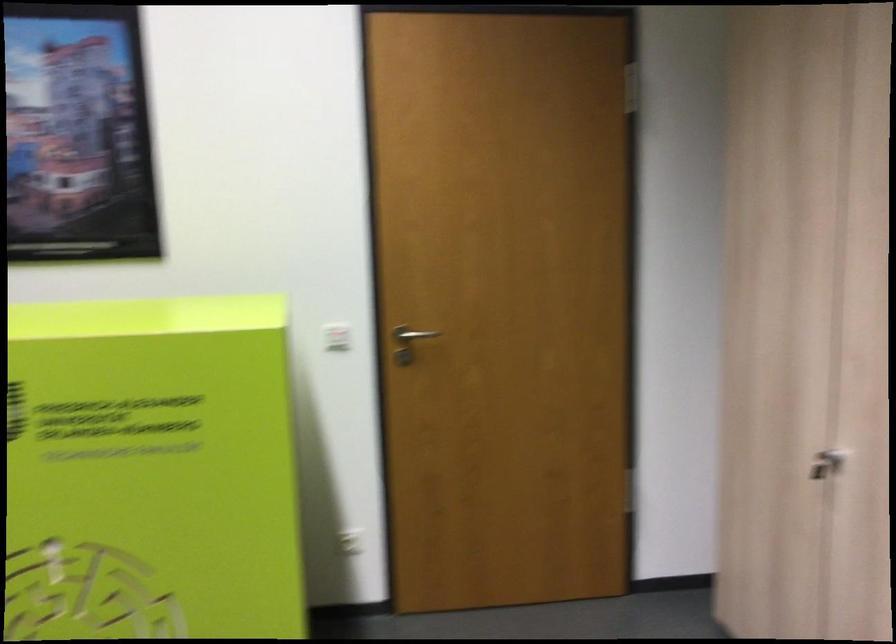
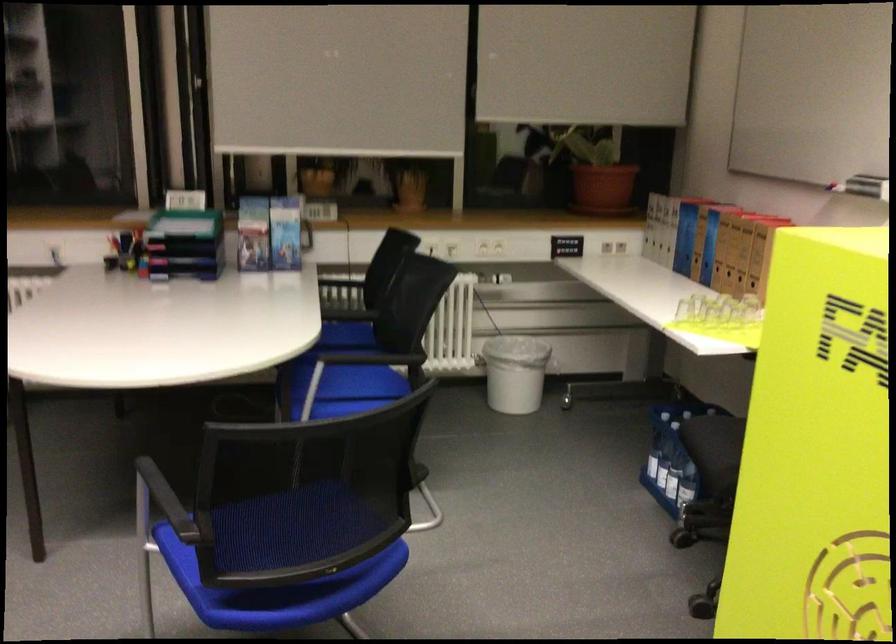
The first image is from the beginning of the video and the second image is from the end. How did the camera likely rotate when shooting the video?

The rotation direction of the camera is left-down.